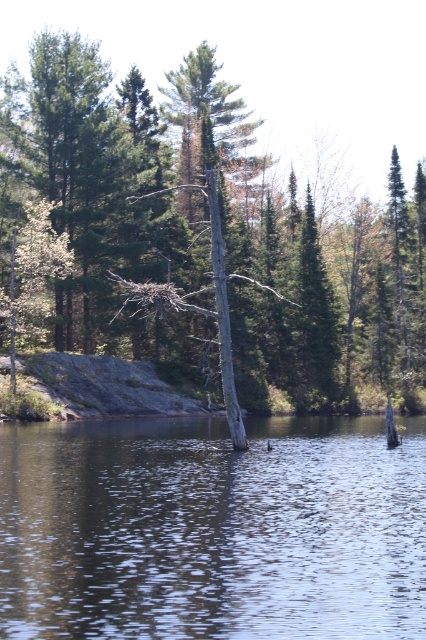
You are standing at the edge of the water and want to place a small boat in the transparent water at center. The boat requires a minimum of 100 feet of distance from any obstacles to avoid collisions. Is the smooth gray tree trunk at center within the safe distance?

The smooth gray tree trunk at center is 111.45 feet away from transparent water at center. Since 111.45 feet is greater than the required 100 feet minimum distance, the boat can be placed safely without colliding with the smooth gray tree trunk at center.

You are an environmental scientist assessing the health of the lake. You observe the smooth gray tree trunk at center and the transparent water at center. Which object has a larger surface area visible in the image?

The smooth gray tree trunk at center is bigger than transparent water at center, so the smooth gray tree trunk at center has a larger surface area visible in the image.

You are standing on the bank of the lake and see the smooth gray tree trunk at center and the transparent water at center. Which object is closer to the surface of the water?

The smooth gray tree trunk at center is located above the transparent water at center, so it is closer to the surface of the water than the transparent water at center itself.